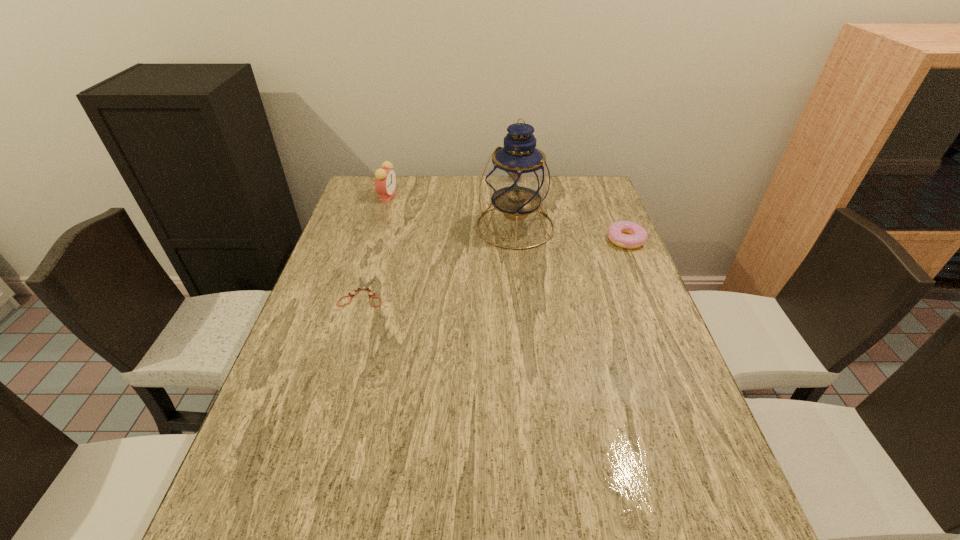
The width and height of the screenshot is (960, 540). I want to click on free spot on the desktop that is between the shears and the rightmost object and is positioned on the front-facing side of the tallest object, so click(469, 271).

This screenshot has width=960, height=540. Find the location of `vacant space on the desktop that is between the shears and the rightmost object and is positioned on the face of the farthest object`. vacant space on the desktop that is between the shears and the rightmost object and is positioned on the face of the farthest object is located at coordinates (471, 270).